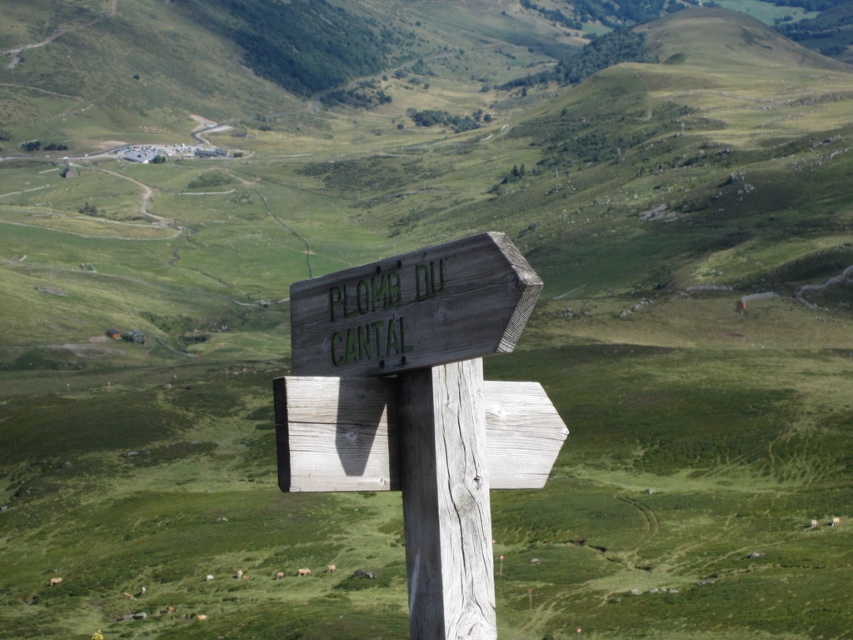
Is wooden signpost at center below weathered wood post at center?

Incorrect, wooden signpost at center is not positioned below weathered wood post at center.

Who is more distant from viewer, (392, 429) or (454, 371)?

The point (392, 429) is behind.

Where is `wooden signpost at center`? The height and width of the screenshot is (640, 853). wooden signpost at center is located at coordinates (419, 410).

Can you confirm if green painted wood sign at center is shorter than weathered wood post at center?

Correct, green painted wood sign at center is not as tall as weathered wood post at center.

This screenshot has height=640, width=853. Find the location of `green painted wood sign at center`. green painted wood sign at center is located at coordinates (413, 308).

Is wooden signpost at center behind green painted wood sign at center?

Yes, wooden signpost at center is further from the viewer.

Where is `wooden signpost at center`? The image size is (853, 640). wooden signpost at center is located at coordinates (419, 410).